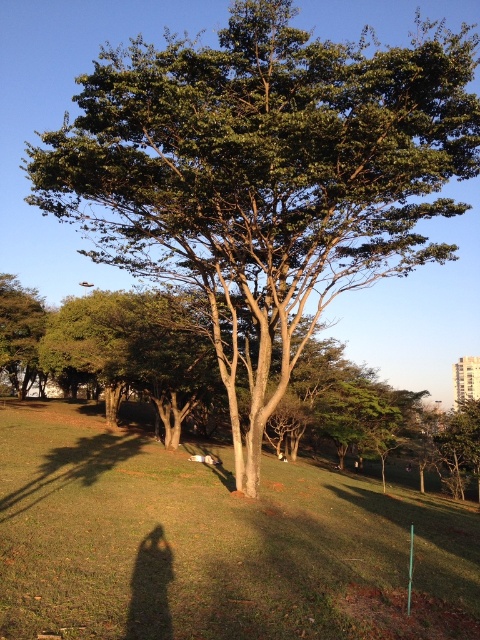
Can you confirm if green grassy at center is shorter than green leafy tree at left?

Yes.

Which of these two, green grassy at center or green leafy tree at left, stands taller?

With more height is green leafy tree at left.

Find the location of `green grassy at center`. green grassy at center is located at coordinates (214, 545).